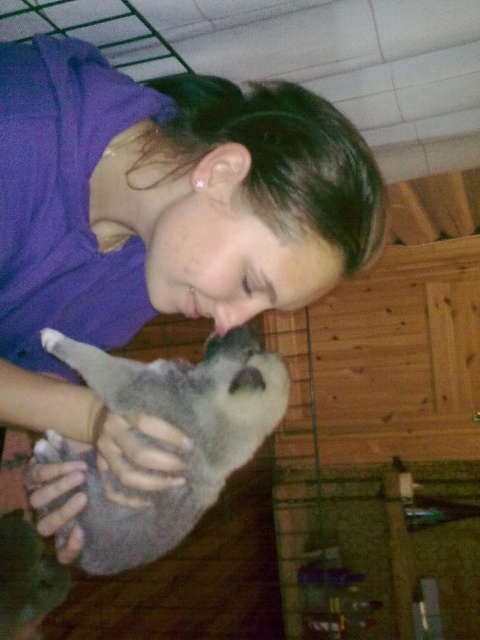
Question: Considering the relative positions of purple fabric at upper left and fuzzy gray cat at center in the image provided, where is purple fabric at upper left located with respect to fuzzy gray cat at center?

Choices:
 (A) left
 (B) right

Answer: (B)

Question: Can you confirm if purple fabric at upper left is positioned below fuzzy gray cat at center?

Choices:
 (A) yes
 (B) no

Answer: (B)

Question: Where is purple fabric at upper left located in relation to fuzzy gray cat at center in the image?

Choices:
 (A) right
 (B) left

Answer: (A)

Question: Which object appears closest to the camera in this image?

Choices:
 (A) fuzzy gray cat at center
 (B) purple fabric at upper left

Answer: (B)

Question: Which of the following is the closest to the observer?

Choices:
 (A) (168, 413)
 (B) (193, 112)

Answer: (A)